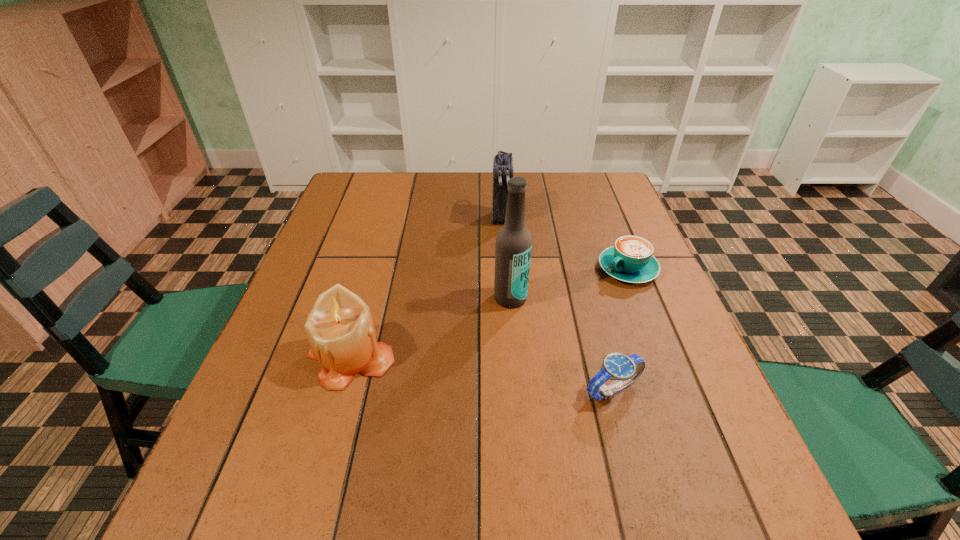
You are a GUI agent. You are given a task and a screenshot of the screen. Output one action in this format:
    pyautogui.click(x=<x>, y=<y>)
    Task: Click on the cappuccino positioned at the right edge
    The width and height of the screenshot is (960, 540).
    Given the screenshot: What is the action you would take?
    pyautogui.click(x=631, y=259)

The width and height of the screenshot is (960, 540). In the image, there is a desktop. In order to click on vacant space at the far edge in this screenshot , I will do `click(519, 173)`.

Locate an element on the screen. The image size is (960, 540). free space at the near edge of the desktop is located at coordinates [x=449, y=456].

You are a GUI agent. You are given a task and a screenshot of the screen. Output one action in this format:
    pyautogui.click(x=<x>, y=<y>)
    Task: Click on the free space at the left edge of the desktop
    The image size is (960, 540).
    Given the screenshot: What is the action you would take?
    pyautogui.click(x=380, y=221)

The height and width of the screenshot is (540, 960). In order to click on free region at the right edge of the desktop in this screenshot , I will do `click(594, 273)`.

This screenshot has height=540, width=960. I want to click on free point at the far left corner, so [345, 190].

The image size is (960, 540). In the image, there is a desktop. What are the coordinates of `blank space at the near left corner` in the screenshot? It's located at (230, 447).

In the image, there is a desktop. In order to click on free space at the near right corner in this screenshot , I will do `click(727, 423)`.

I want to click on empty space between the watch and the farthest object, so click(x=557, y=303).

Where is `free spot between the watch and the beer bottle`? The image size is (960, 540). free spot between the watch and the beer bottle is located at coordinates (562, 344).